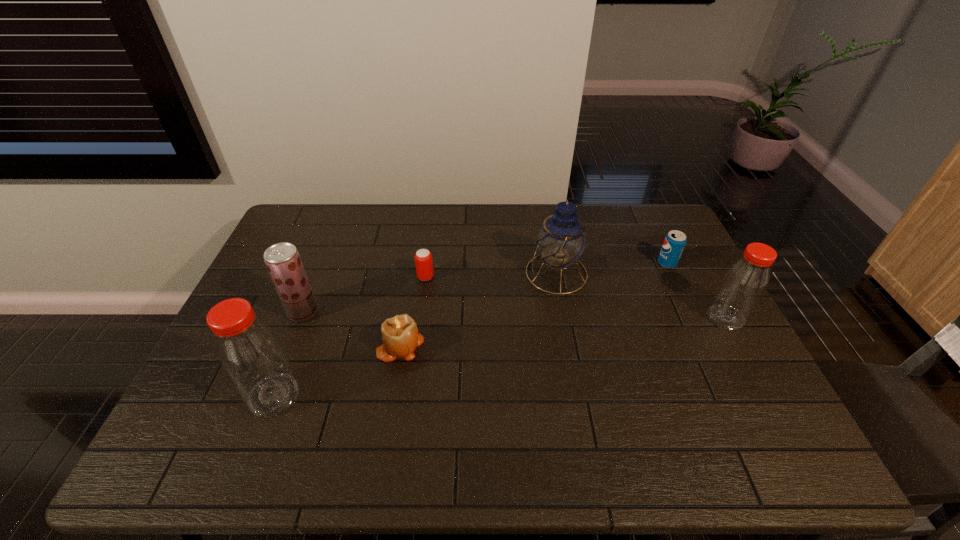
I want to click on the left bottle, so click(x=248, y=350).

Image resolution: width=960 pixels, height=540 pixels. Find the location of `the taller bottle`. the taller bottle is located at coordinates (248, 350).

This screenshot has height=540, width=960. I want to click on the right bottle, so click(x=743, y=285).

This screenshot has width=960, height=540. What are the coordinates of `the shorter bottle` in the screenshot? It's located at (743, 285).

The image size is (960, 540). In order to click on the sixth object from left to right in this screenshot , I will do `click(674, 243)`.

Find the location of a particular element. This screenshot has width=960, height=540. beer can is located at coordinates (423, 258).

Where is `candle`? The height and width of the screenshot is (540, 960). candle is located at coordinates (400, 336).

I want to click on the third object from right to left, so click(x=561, y=241).

In order to click on fruit juice in this screenshot , I will do `click(284, 264)`.

The image size is (960, 540). What are the coordinates of `free region located 0.230m on the right of the nearest object` in the screenshot? It's located at (394, 395).